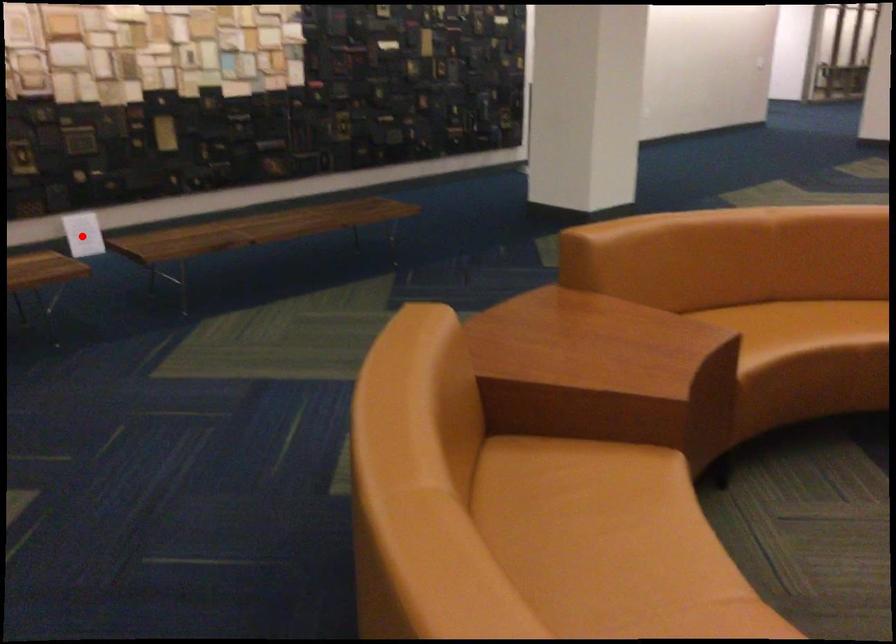
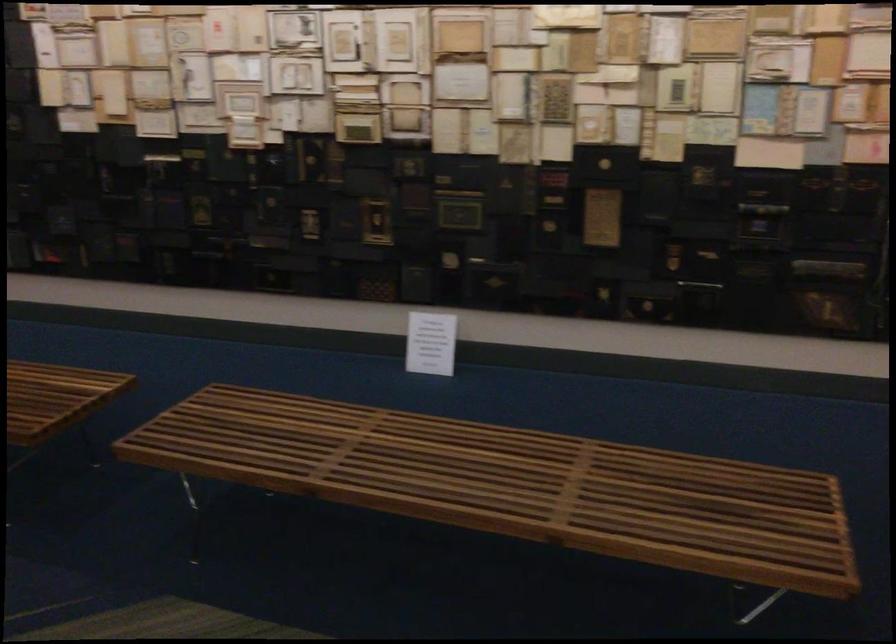
Question: I am providing you with two images of the same scene from different viewpoints. A red point is shown in image1. For the corresponding object point in image2, is it positioned nearer or farther from the camera?

Choices:
 (A) Nearer
 (B) Farther

Answer: (A)